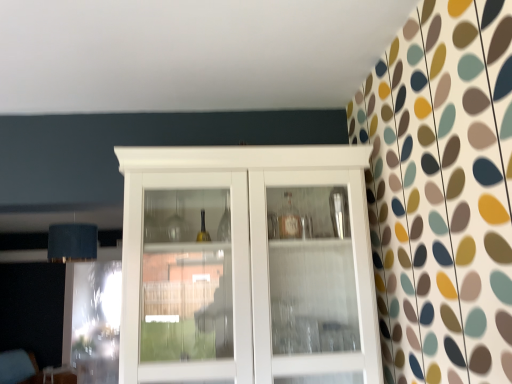
In order to face white glossy cupboard at center, should I rotate leftwards or rightwards?

It's best to rotate left around 1.024 degrees.

Measure the distance between white glossy cupboard at center and camera.

1.38 meters.

What do you see at coordinates (247, 266) in the screenshot? This screenshot has height=384, width=512. I see `white glossy cupboard at center` at bounding box center [247, 266].

Find the location of a particular element. The height and width of the screenshot is (384, 512). white glossy cupboard at center is located at coordinates (247, 266).

The image size is (512, 384). Identify the location of white glossy cupboard at center. (247, 266).